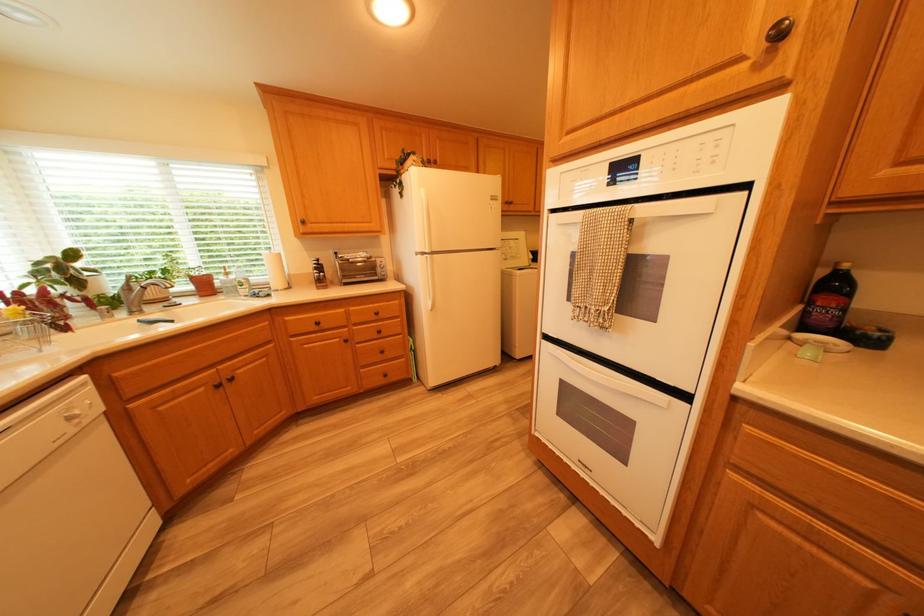
Which object does [868,336] point to?

This point indicates the small dark bowl.